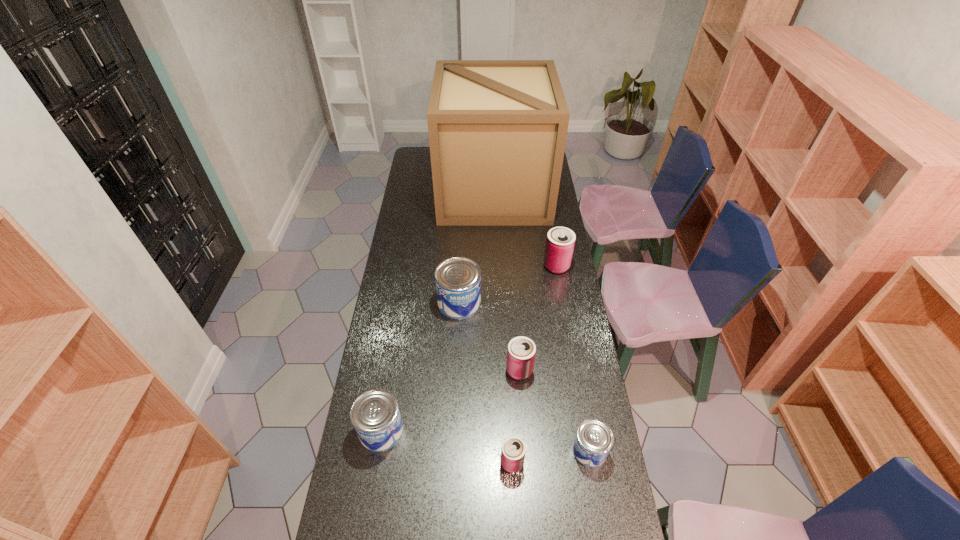
The height and width of the screenshot is (540, 960). I want to click on the farthest object, so click(x=497, y=129).

Locate an element on the screen. the tallest object is located at coordinates (497, 129).

Identify the location of the biggest pink can. The height and width of the screenshot is (540, 960). (560, 241).

At what (x,y) coordinates should I click in order to perform the action: click on the farthest pink can. Please return your answer as a coordinate pair (x, y). The image size is (960, 540). Looking at the image, I should click on (560, 241).

Locate an element on the screen. This screenshot has width=960, height=540. the biggest blue can is located at coordinates [458, 280].

Where is `the second blue can from left to right`? the second blue can from left to right is located at coordinates (458, 280).

Where is `the third farthest can`? This screenshot has width=960, height=540. the third farthest can is located at coordinates (521, 351).

This screenshot has height=540, width=960. I want to click on the fourth farthest object, so click(521, 351).

You are a GUI agent. You are given a task and a screenshot of the screen. Output one action in this format:
    pyautogui.click(x=<x>, y=<y>)
    Task: Click on the leftmost object
    
    Given the screenshot: What is the action you would take?
    pyautogui.click(x=375, y=415)

The height and width of the screenshot is (540, 960). In order to click on the leftmost can in this screenshot , I will do `click(375, 415)`.